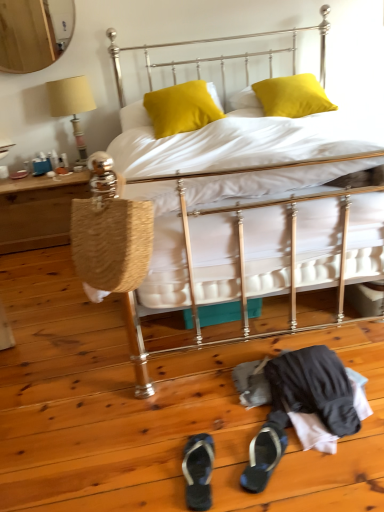
Question: Is woven wood table at left next to matte yellow fabric lampshade at left?

Choices:
 (A) yes
 (B) no

Answer: (B)

Question: Does woven wood table at left have a smaller size compared to matte yellow fabric lampshade at left?

Choices:
 (A) no
 (B) yes

Answer: (A)

Question: Can you confirm if woven wood table at left is thinner than matte yellow fabric lampshade at left?

Choices:
 (A) no
 (B) yes

Answer: (A)

Question: Is woven wood table at left positioned behind matte yellow fabric lampshade at left?

Choices:
 (A) yes
 (B) no

Answer: (B)

Question: Is woven wood table at left positioned with its back to matte yellow fabric lampshade at left?

Choices:
 (A) no
 (B) yes

Answer: (A)

Question: In terms of width, does gold wooden mirror at upper left look wider or thinner when compared to satin yellow pillow at upper center, marked as the first pillow in a right-to-left arrangement?

Choices:
 (A) thin
 (B) wide

Answer: (A)

Question: Is gold wooden mirror at upper left inside or outside of satin yellow pillow at upper center, marked as the first pillow in a right-to-left arrangement?

Choices:
 (A) inside
 (B) outside

Answer: (B)

Question: Is point (34, 22) closer or farther from the camera than point (284, 100)?

Choices:
 (A) farther
 (B) closer

Answer: (A)

Question: Relative to satin yellow pillow at upper center, which appears as the 2th pillow when viewed from the left, is gold wooden mirror at upper left in front or behind?

Choices:
 (A) behind
 (B) front

Answer: (A)

Question: Looking at their shapes, would you say metallic bed at center is wider or thinner than woven wood table at left?

Choices:
 (A) wide
 (B) thin

Answer: (A)

Question: Do you think metallic bed at center is within woven wood table at left, or outside of it?

Choices:
 (A) inside
 (B) outside

Answer: (B)

Question: Considering the positions of point (309, 209) and point (16, 202), is point (309, 209) closer or farther from the camera than point (16, 202)?

Choices:
 (A) farther
 (B) closer

Answer: (B)

Question: From a real-world perspective, relative to woven wood table at left, is metallic bed at center vertically above or below?

Choices:
 (A) above
 (B) below

Answer: (A)

Question: Which is correct: satin yellow pillow at center, positioned as the first pillow in left-to-right order, is inside matte yellow fabric lampshade at left, or outside of it?

Choices:
 (A) inside
 (B) outside

Answer: (B)

Question: Relative to matte yellow fabric lampshade at left, is satin yellow pillow at center, positioned as the first pillow in left-to-right order, in front or behind?

Choices:
 (A) behind
 (B) front

Answer: (B)